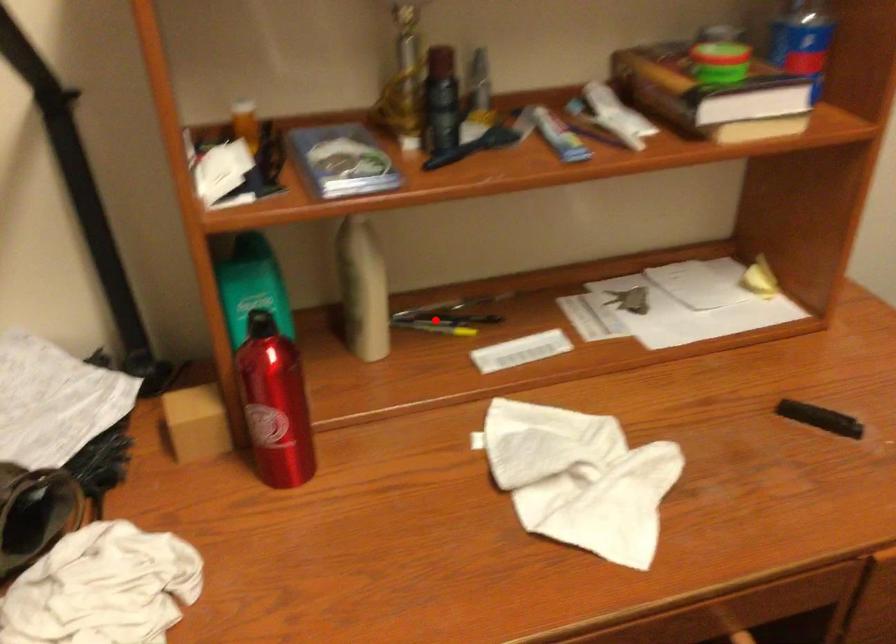
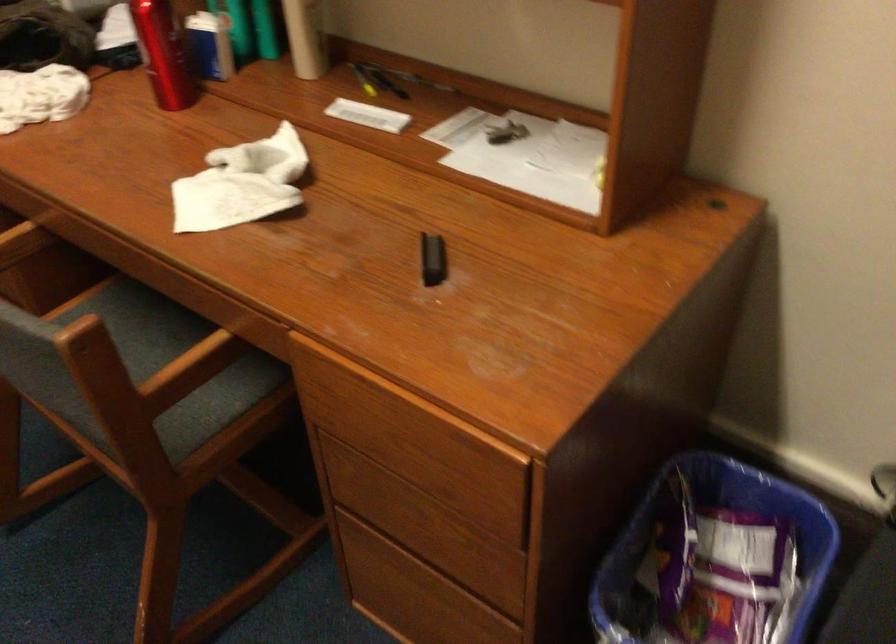
Question: I am providing you with two images of the same scene from different viewpoints. In image1, a red point is highlighted. Considering the same 3D point in image2, which of the following is correct?

Choices:
 (A) It is closer
 (B) It is farther

Answer: (B)